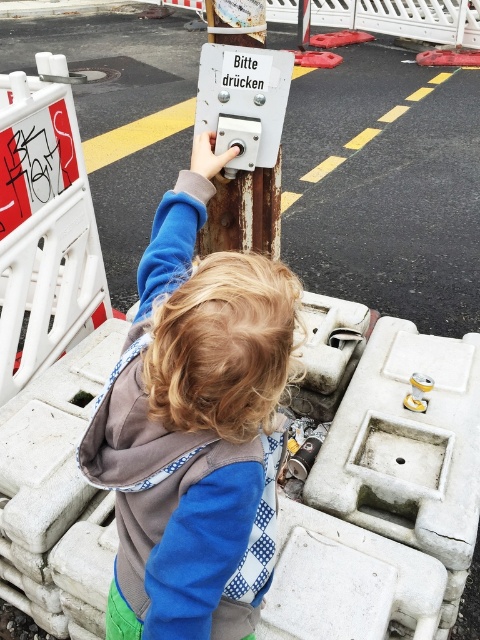
Question: Does blue fleece jacket at center have a smaller size compared to rusty metal button at center?

Choices:
 (A) no
 (B) yes

Answer: (A)

Question: Where is blue fleece jacket at center located in relation to rusty metal button at center in the image?

Choices:
 (A) below
 (B) above

Answer: (A)

Question: Which object appears farthest from the camera in this image?

Choices:
 (A) rusty metal button at center
 (B) blue fleece jacket at center

Answer: (A)

Question: Which point is farther to the camera?

Choices:
 (A) (190, 221)
 (B) (265, 195)

Answer: (B)

Question: Observing the image, what is the correct spatial positioning of blue fleece jacket at center in reference to rusty metal button at center?

Choices:
 (A) left
 (B) right

Answer: (A)